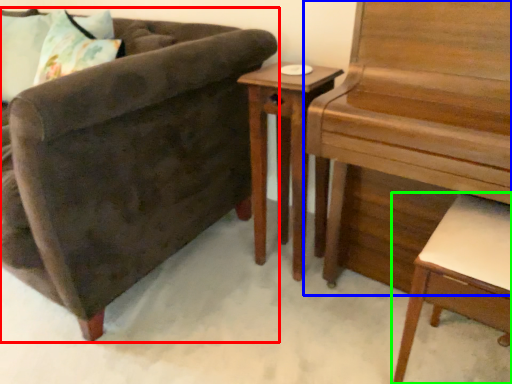
Question: Estimate the real-world distances between objects in this image. Which object is closer to chair (highlighted by a red box), piano (highlighted by a blue box) or desk (highlighted by a green box)?

Choices:
 (A) piano
 (B) desk

Answer: (A)